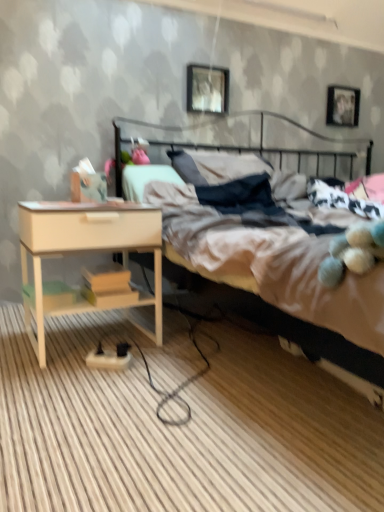
Where is `vacant area that lies in front of beige wood nightstand at lower left`? This screenshot has width=384, height=512. vacant area that lies in front of beige wood nightstand at lower left is located at coordinates (79, 390).